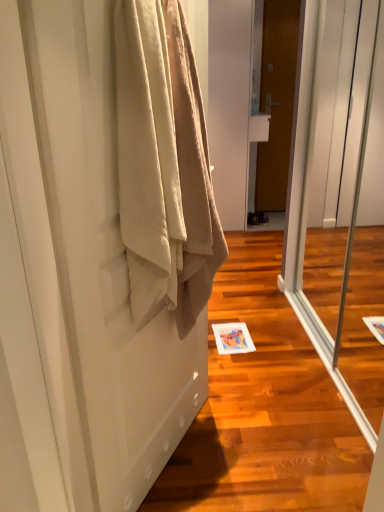
Question: Is beige fabric door at left, placed as the second door when sorted from right to left, not close to beige textured towel at left?

Choices:
 (A) yes
 (B) no

Answer: (B)

Question: Is beige fabric door at left, which is the 1th door from front to back, positioned with its back to beige textured towel at left?

Choices:
 (A) no
 (B) yes

Answer: (B)

Question: Can you confirm if beige fabric door at left, which is the 1th door from front to back, is positioned to the left of beige textured towel at left?

Choices:
 (A) no
 (B) yes

Answer: (B)

Question: From a real-world perspective, is beige fabric door at left, which is the first door in left-to-right order, below beige textured towel at left?

Choices:
 (A) no
 (B) yes

Answer: (B)

Question: From the image's perspective, is beige fabric door at left, which is the 1th door from front to back, located above beige textured towel at left?

Choices:
 (A) yes
 (B) no

Answer: (B)

Question: Considering the relative positions of beige fabric door at left, which is counted as the first door, starting from the bottom, and beige textured towel at left in the image provided, is beige fabric door at left, which is counted as the first door, starting from the bottom, to the right of beige textured towel at left from the viewer's perspective?

Choices:
 (A) no
 (B) yes

Answer: (A)

Question: Is beige fabric door at left, which is the 1th door from front to back, bigger than brown wooden door at center, which is counted as the 1th door, starting from the top?

Choices:
 (A) no
 (B) yes

Answer: (B)

Question: Is beige fabric door at left, which is counted as the first door, starting from the bottom, far from brown wooden door at center, positioned as the first door in right-to-left order?

Choices:
 (A) yes
 (B) no

Answer: (A)

Question: Is beige fabric door at left, which appears as the second door when viewed from the back, at the right side of brown wooden door at center, which ranks as the second door in front-to-back order?

Choices:
 (A) no
 (B) yes

Answer: (A)

Question: Is beige fabric door at left, which is the first door in left-to-right order, oriented towards brown wooden door at center, which ranks as the second door in front-to-back order?

Choices:
 (A) yes
 (B) no

Answer: (B)

Question: Is the depth of beige fabric door at left, the 2th door positioned from the top, less than that of brown wooden door at center, positioned as the first door in right-to-left order?

Choices:
 (A) yes
 (B) no

Answer: (A)

Question: Can you see beige fabric door at left, placed as the second door when sorted from right to left, touching brown wooden door at center, the second door ordered from the bottom?

Choices:
 (A) yes
 (B) no

Answer: (B)

Question: Is transparent glass screen door at center aimed at beige textured towel at left?

Choices:
 (A) no
 (B) yes

Answer: (B)